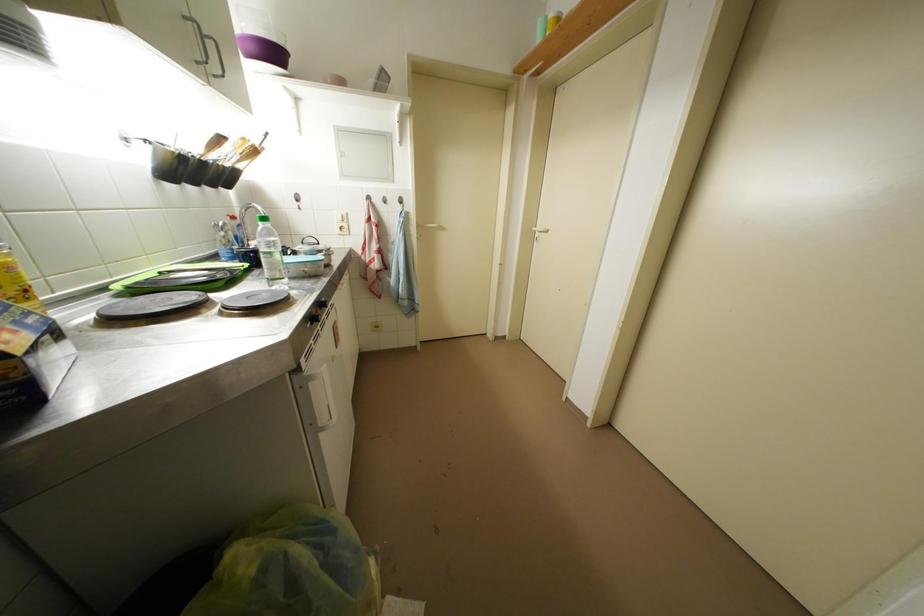
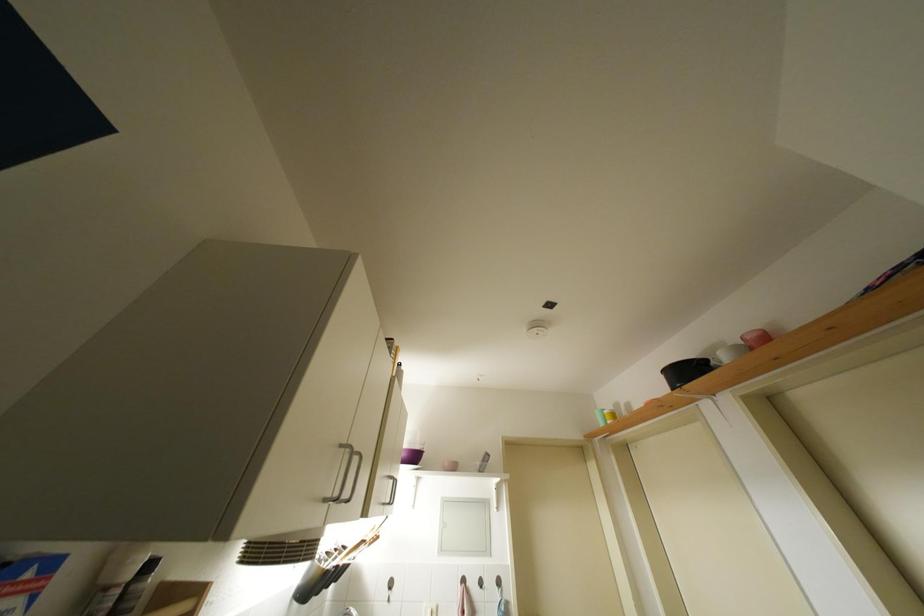
The point at (259, 53) is marked in the first image. Where is the corresponding point in the second image?

(410, 459)